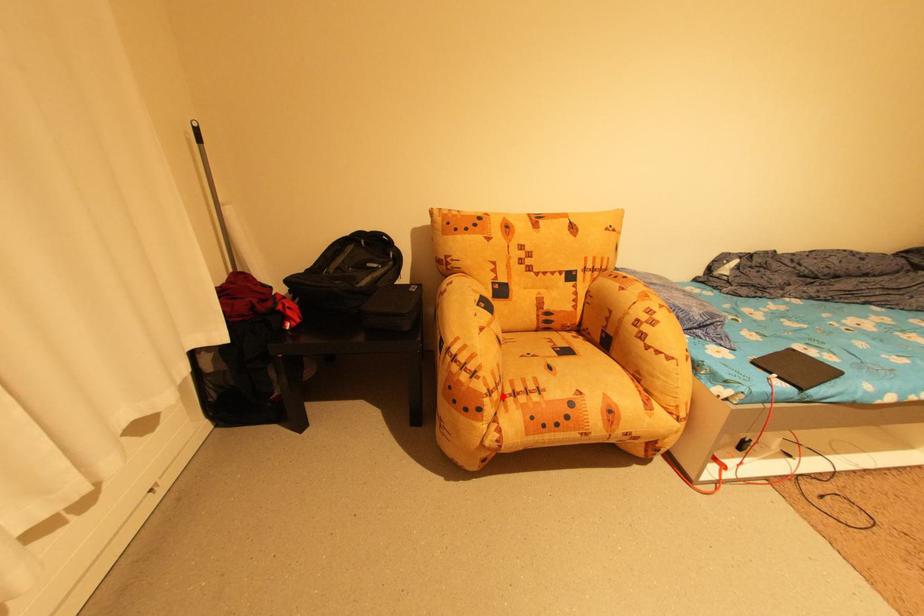
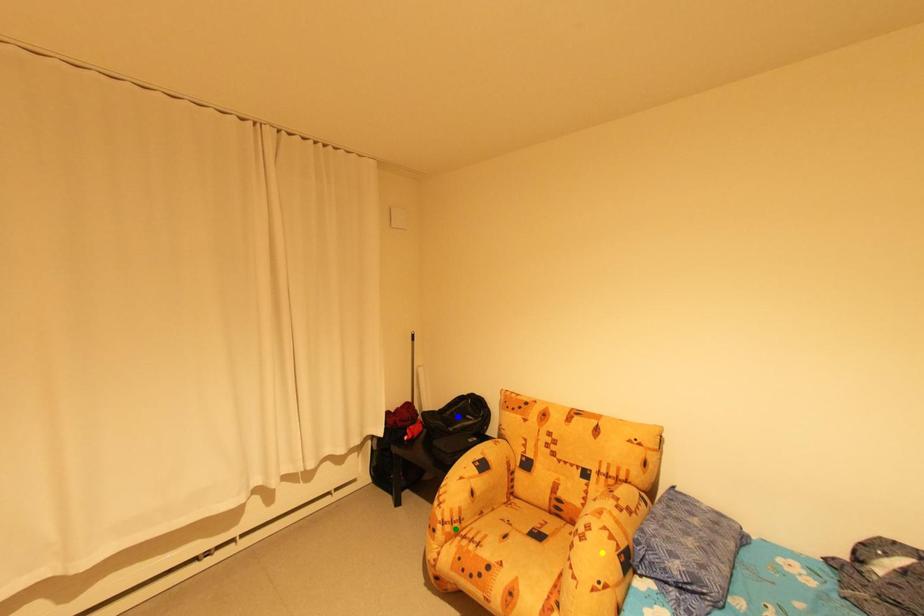
Question: I am providing you with two images of the same scene from different viewpoints. A red point is marked on the first image. You are given multiple points on the second image. Can you choose the point in image 2 that corresponds to the point in image 1?

Choices:
 (A) yellow point
 (B) green point
 (C) blue point

Answer: (B)